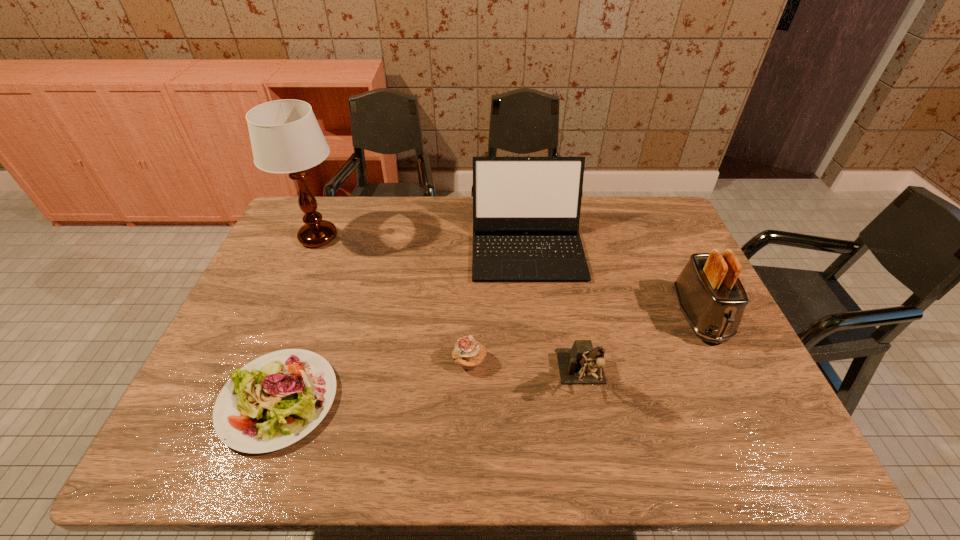
Identify the location of free spot at the far edge of the desktop. (411, 213).

The image size is (960, 540). Find the location of `free location at the near edge`. free location at the near edge is located at coordinates (330, 455).

Identify the location of vacant space at the left edge of the desktop. Image resolution: width=960 pixels, height=540 pixels. (279, 275).

Find the location of a particular element. This screenshot has width=960, height=540. free point between the second shortest object and the toaster is located at coordinates (585, 339).

Identify the location of free space between the rightmost object and the figurine. (641, 347).

Identify the location of free space that is in between the cupcake and the figurine. (526, 370).

Locate an element on the screen. vacant area that lies between the tallest object and the cupcake is located at coordinates (394, 300).

Image resolution: width=960 pixels, height=540 pixels. I want to click on blank region between the table lamp and the figurine, so click(x=450, y=308).

I want to click on vacant space that is in between the salad plate and the cupcake, so click(374, 381).

This screenshot has height=540, width=960. I want to click on vacant point located between the laptop and the second shortest object, so click(x=498, y=305).